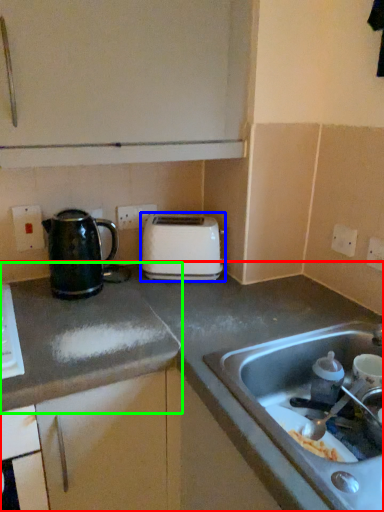
Question: Which is farther away from countertop (highlighted by a red box)? toaster (highlighted by a blue box) or countertop (highlighted by a green box)?

Choices:
 (A) toaster
 (B) countertop

Answer: (A)